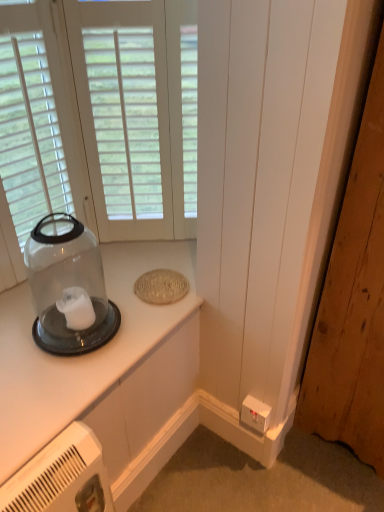
The width and height of the screenshot is (384, 512). Identify the location of vacant space behind transparent glass jar at left. (87, 282).